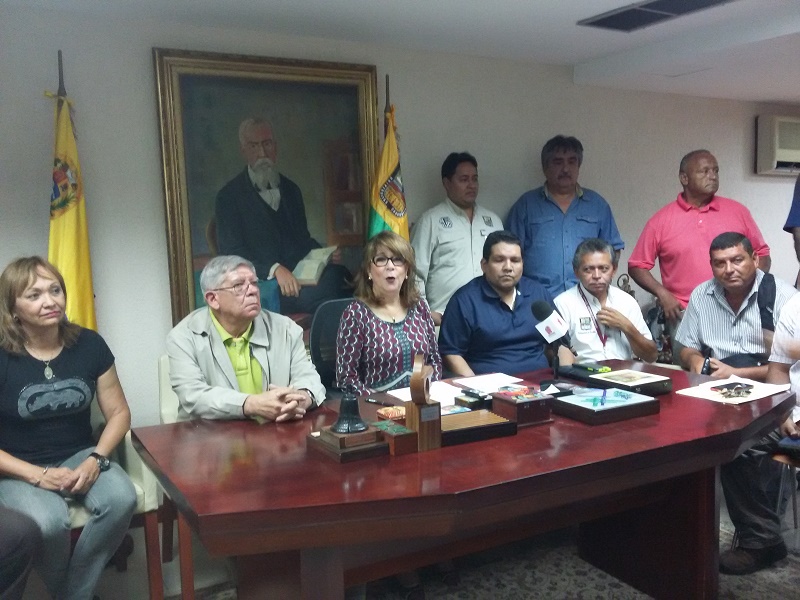
Find the location of `ceiling`. ceiling is located at coordinates (514, 0).